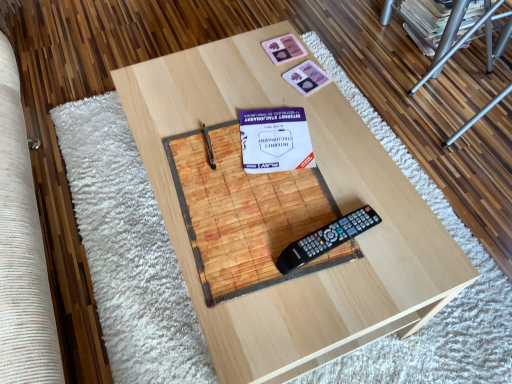
What are the coordinates of `free space to the left of metallic silver ladder at upper right` in the screenshot? It's located at (385, 116).